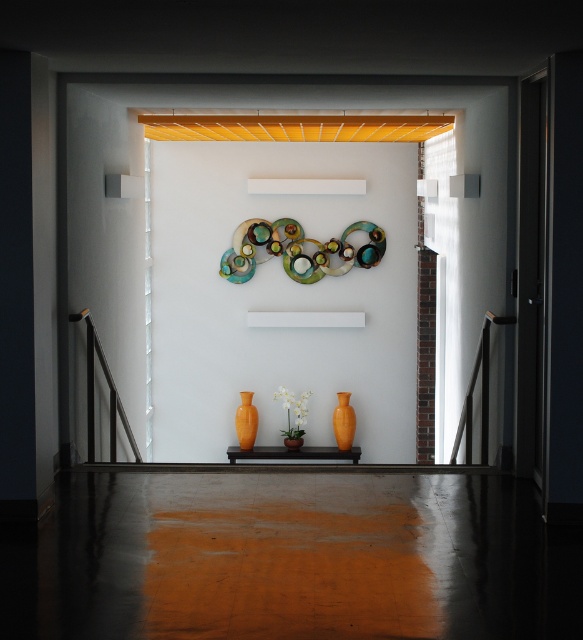
Question: Can you confirm if metallic multicolored circular shapes at upper center is thinner than orange matte vase at center?

Choices:
 (A) no
 (B) yes

Answer: (A)

Question: Which object is positioned farthest from the orange matte vase at center?

Choices:
 (A) translucent glass vase at center
 (B) orange glossy vase at center

Answer: (B)

Question: Observing the image, what is the correct spatial positioning of metallic multicolored circular shapes at upper center in reference to orange matte vase at center?

Choices:
 (A) above
 (B) below

Answer: (A)

Question: Which point is farther to the camera?

Choices:
 (A) (285, 433)
 (B) (244, 401)

Answer: (B)

Question: Can you confirm if translucent glass vase at center is bigger than orange matte vase at center?

Choices:
 (A) yes
 (B) no

Answer: (A)

Question: Which point is farther from the camera taking this photo?

Choices:
 (A) (233, 234)
 (B) (343, 445)
 (C) (243, 442)
 (D) (280, 433)

Answer: (D)